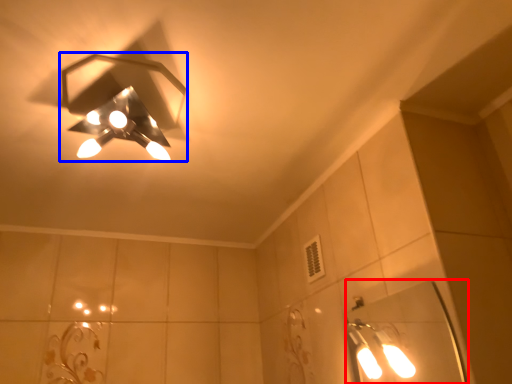
Question: Which point is further to the camera, mirror (highlighted by a red box) or lamp (highlighted by a blue box)?

Choices:
 (A) mirror
 (B) lamp

Answer: (A)